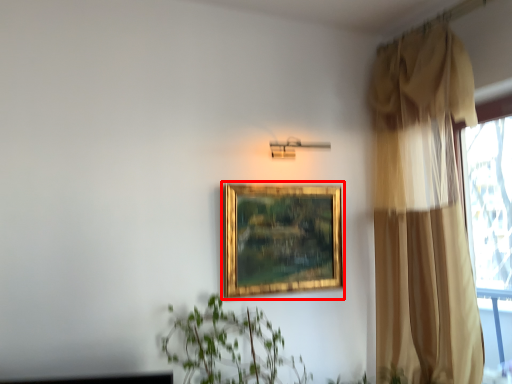
Question: Where is picture frame (annotated by the red box) located in relation to curtain in the image?

Choices:
 (A) right
 (B) left

Answer: (B)